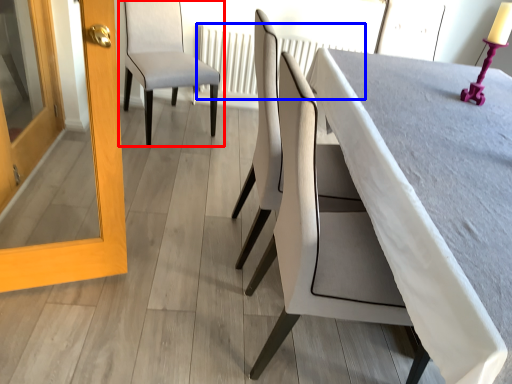
Question: Which object is closer to the camera taking this photo, chair (highlighted by a red box) or radiator (highlighted by a blue box)?

Choices:
 (A) chair
 (B) radiator

Answer: (A)